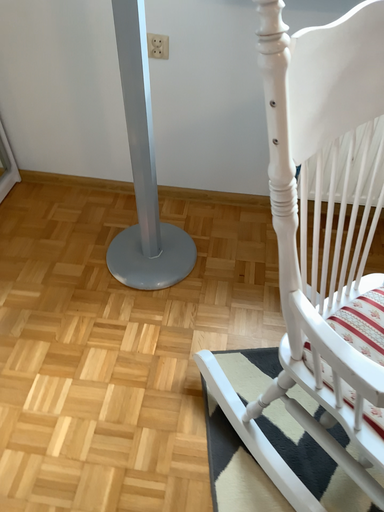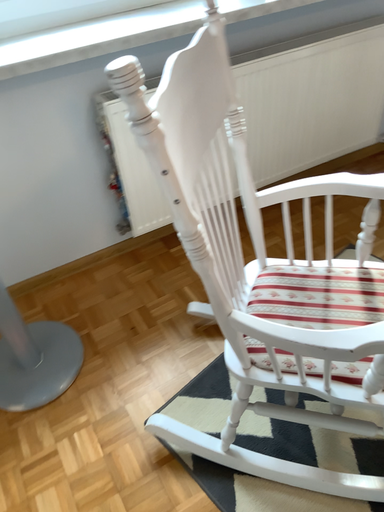
Question: Which way did the camera rotate in the video?

Choices:
 (A) rotated left
 (B) rotated right

Answer: (B)